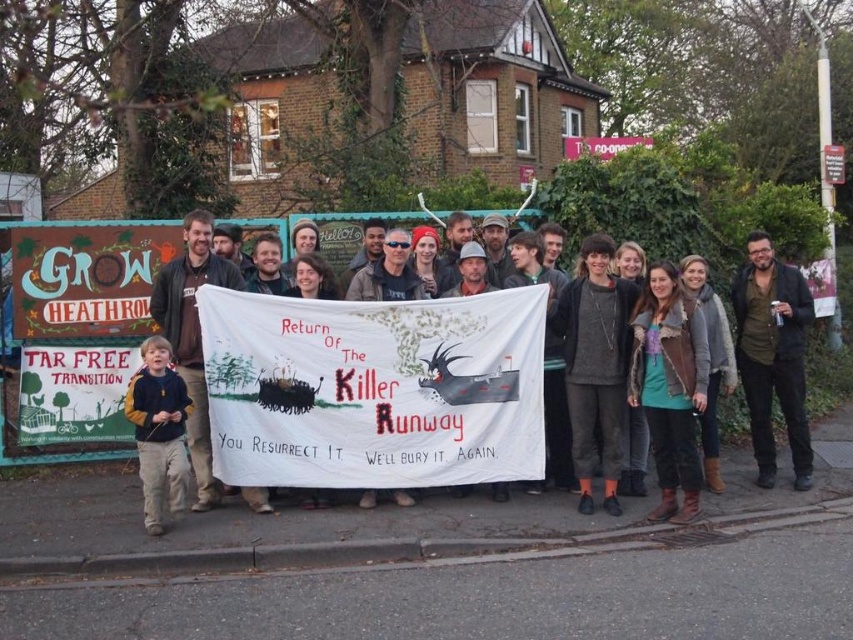
You are a photographer trying to capture a clear photo of the dark gray sweater at center and the dark blue shirt at left. Which person should you focus on first to ensure both are in the frame?

You should focus on the dark gray sweater at center first because the dark blue shirt at left is behind it, so capturing the front person ensures both are visible.

You are a photographer trying to capture a closeup of the dark gray sweater at center and the velvet yellow sweater at lower left. Which sweater should you zoom in on to ensure both are in focus if your camera can only focus on one width?

The dark gray sweater at center has a greater width than the velvet yellow sweater at lower left, so you should zoom in on the dark gray sweater at center to ensure both are in focus.

What is located at the point with coordinates (74, 394)?

The green paper sign at lower left is located at point (74, 394).